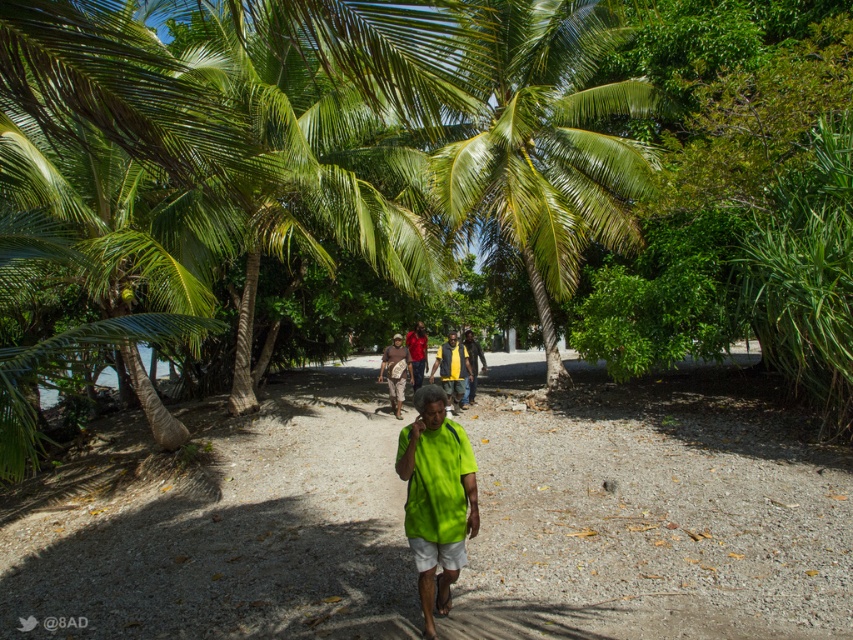
Question: Which of the following is the closest to the observer?

Choices:
 (A) (468, 454)
 (B) (471, 372)
 (C) (399, 365)
 (D) (180, 497)

Answer: (A)

Question: Is yellow fabric shirt at center bigger than matte red shirt at center?

Choices:
 (A) yes
 (B) no

Answer: (A)

Question: Which of the following is the farthest from the observer?

Choices:
 (A) brown fabric bag at center
 (B) yellow-green fabric shirt at center

Answer: (B)

Question: In this image, where is green fabric shirt at center located relative to matte red shirt at center?

Choices:
 (A) right
 (B) left

Answer: (A)

Question: Is green fabric shirt at center smaller than neon green fabric shirt at center?

Choices:
 (A) no
 (B) yes

Answer: (A)

Question: Which object appears farthest from the camera in this image?

Choices:
 (A) yellow-green fabric shirt at center
 (B) neon green fabric shirt at center
 (C) matte red shirt at center

Answer: (C)